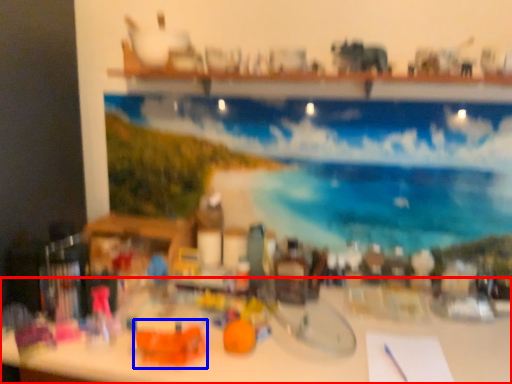
Question: Which point is closer to the camera, table (highlighted by a red box) or toy (highlighted by a blue box)?

Choices:
 (A) table
 (B) toy

Answer: (A)